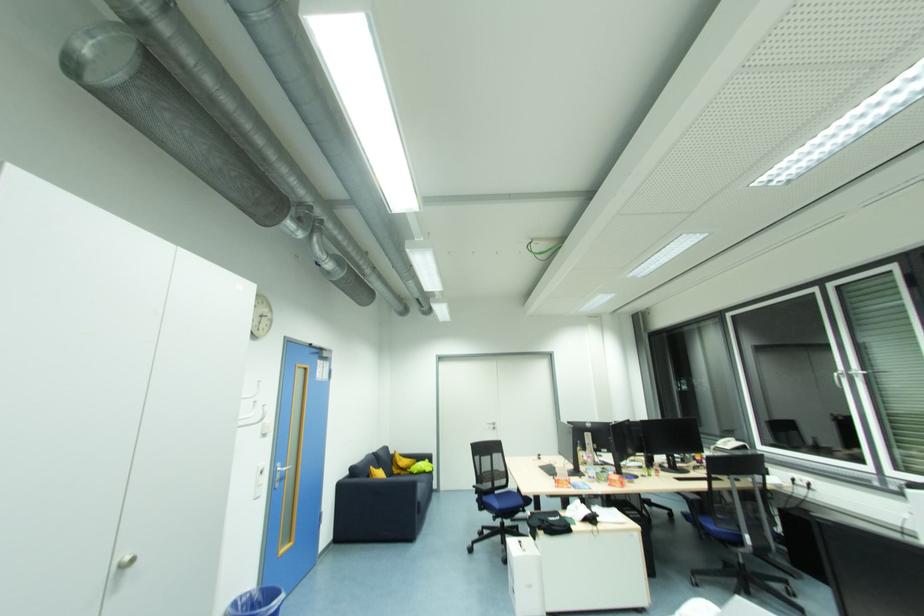
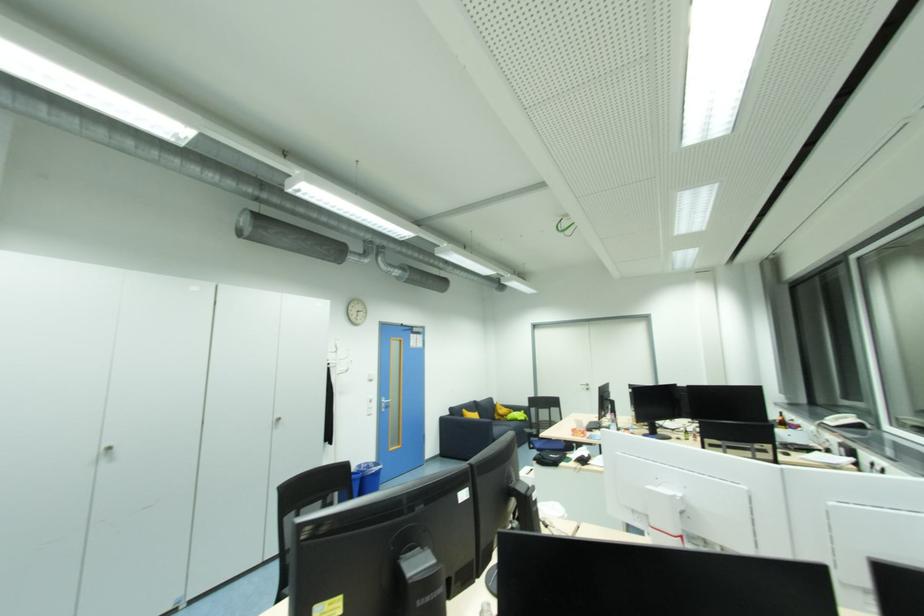
Question: I am providing you with two images of the same scene from different viewpoints. Which of the following objects are not visible in image2?

Choices:
 (A) black chair back top rail
 (B) yellow pillow
 (C) white telephone receiver
 (D) none of these

Answer: (D)